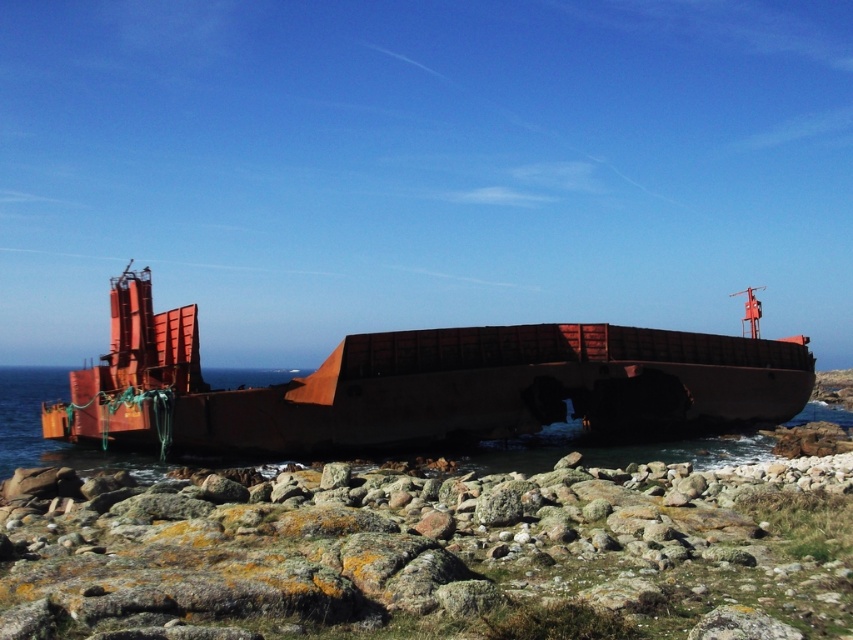
You are a marine biologist observing the shipwreck from a boat. You notice two points marked on the shipwreck. The first point is at coordinate point (x=659, y=384) and the second is at point (x=480, y=461). From your vantage point, which point is closer to you?

Point (x=480, y=461) is closer to you because the Objects Description states that point (x=659, y=384) is behind point (x=480, y=461).

You are standing on the rocky shoreline looking at the stranded ship. Can you determine which object, the rusty metal boat at center or the rusty metal water at center, is closer to you?

The rusty metal boat at center is closer to the viewer than the rusty metal water at center.